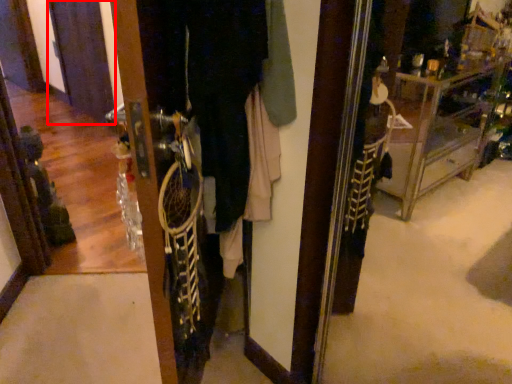
Question: From the image, what is the correct spatial relationship of screen door (annotated by the red box) in relation to closet?

Choices:
 (A) right
 (B) left

Answer: (B)